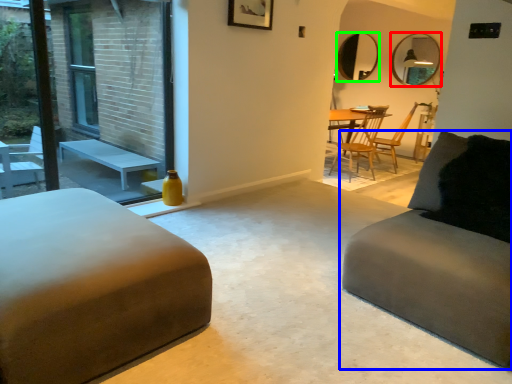
Question: Which is nearer to the mirror (highlighted by a red box)? studio couch (highlighted by a blue box) or mirror (highlighted by a green box).

Choices:
 (A) studio couch
 (B) mirror

Answer: (B)